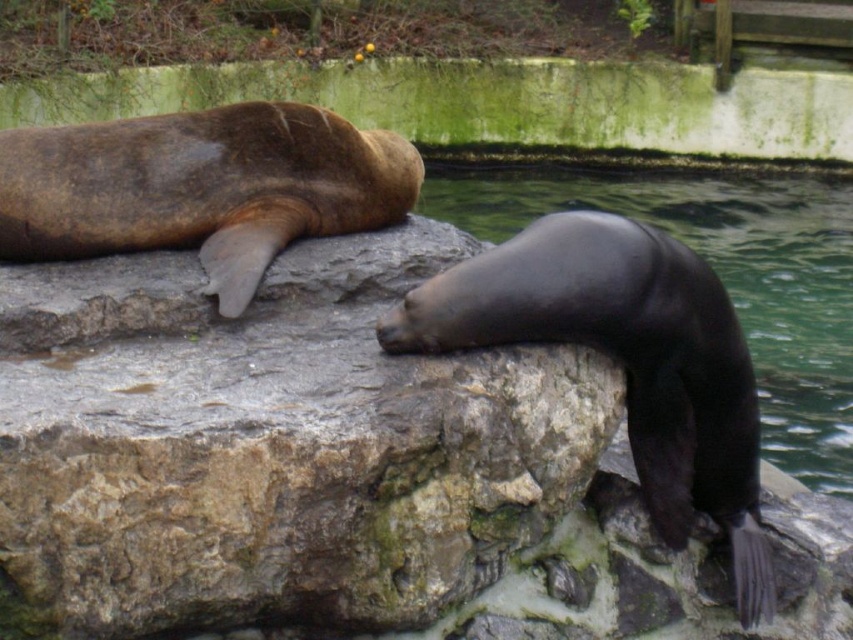
You are a wildlife photographer aiming to capture a photo of both the brown rough rock at center and the glossy black seal at right. Based on their positions, which object should you adjust your camera focus on first if you want to ensure both are in the frame?

The brown rough rock at center is to the left of glossy black seal at right, so you should focus on the glossy black seal at right first to ensure both are in the frame.

You are a marine biologist observing the sea lions from a boat anchored 10 meters away from the rocks. You notice a point marked at coordinates (270,445) on your map. What does this point represent?

The point at (270,445) represents the brown rough rock at center.

You are standing at the point labeled point (15, 595) and want to get to the point labeled point (714, 259). Which direction should you move to reach your destination?

You should move backward to reach point (714, 259) because point (15, 595) is in front of it.